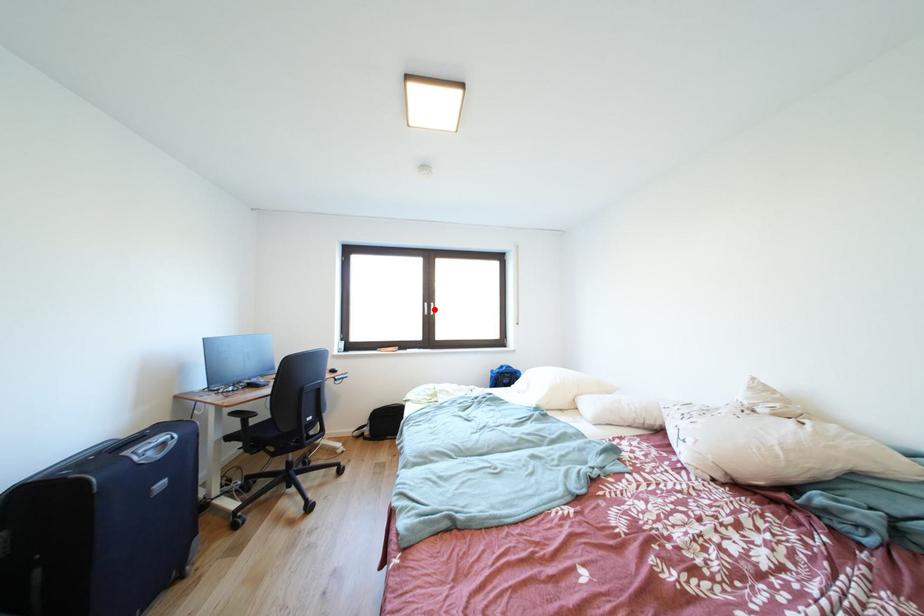
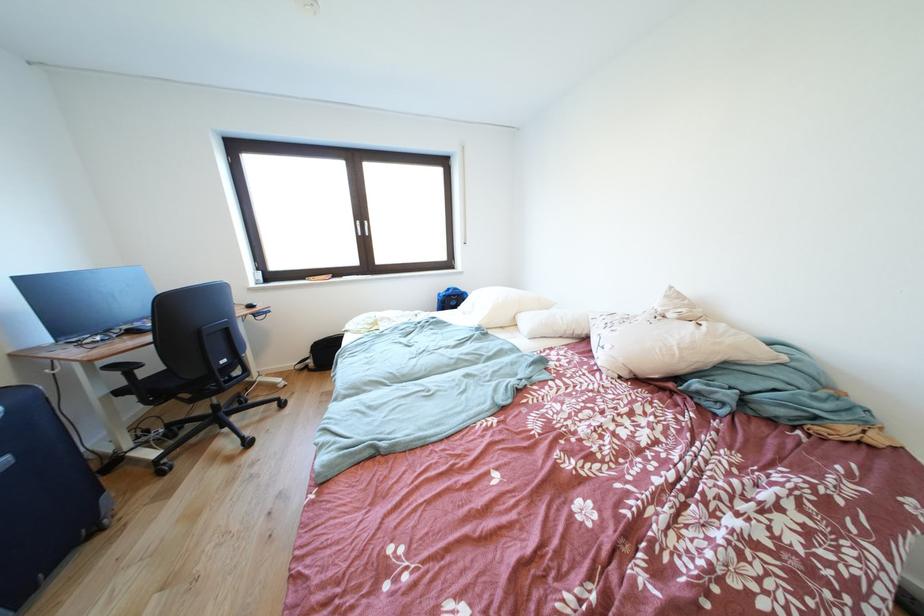
Question: I am providing you with two images of the same scene from different viewpoints. In image1, a red point is highlighted. Considering the same 3D point in image2, which of the following is correct?

Choices:
 (A) It is closer
 (B) It is farther

Answer: (A)